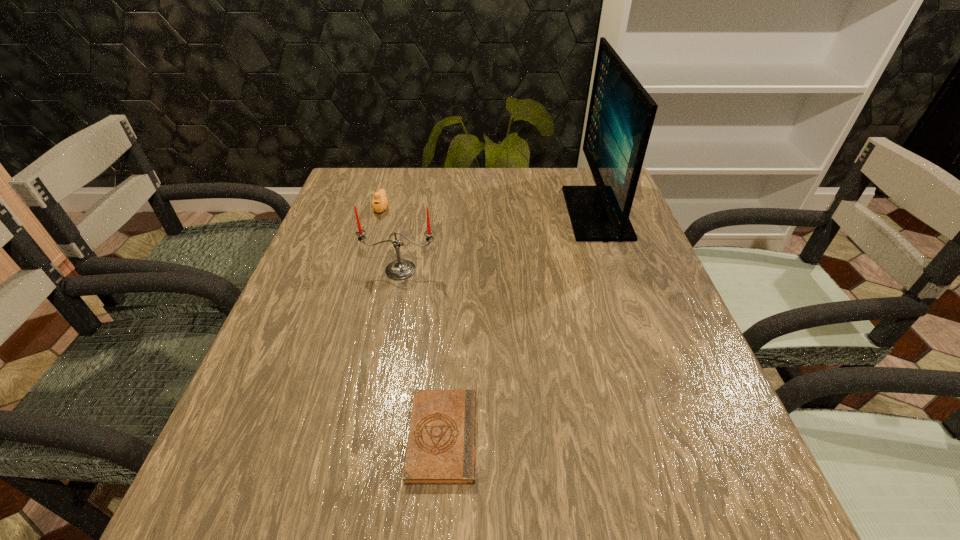
Locate an element on the screen. The image size is (960, 540). free space located 0.280m on the face of the duckling is located at coordinates (357, 290).

Image resolution: width=960 pixels, height=540 pixels. Find the location of `vacant region located 0.290m on the spine side of the shortest object`. vacant region located 0.290m on the spine side of the shortest object is located at coordinates (x=658, y=436).

At what (x,y) coordinates should I click in order to perform the action: click on monitor that is at the far edge. Please return your answer as a coordinate pair (x, y). The image size is (960, 540). Looking at the image, I should click on (621, 114).

Where is `duckling that is at the far edge`? This screenshot has height=540, width=960. duckling that is at the far edge is located at coordinates (379, 202).

Find the location of a particular element. The width and height of the screenshot is (960, 540). object at the near edge is located at coordinates (441, 445).

I want to click on candle situated at the left edge, so click(400, 269).

Find the location of a particular element. The height and width of the screenshot is (540, 960). duckling positioned at the left edge is located at coordinates (379, 202).

I want to click on object present at the right edge, so click(x=621, y=114).

Locate an element on the screen. Image resolution: width=960 pixels, height=540 pixels. object located in the far left corner section of the desktop is located at coordinates (379, 202).

The width and height of the screenshot is (960, 540). Find the location of `object located at the far right corner`. object located at the far right corner is located at coordinates (621, 114).